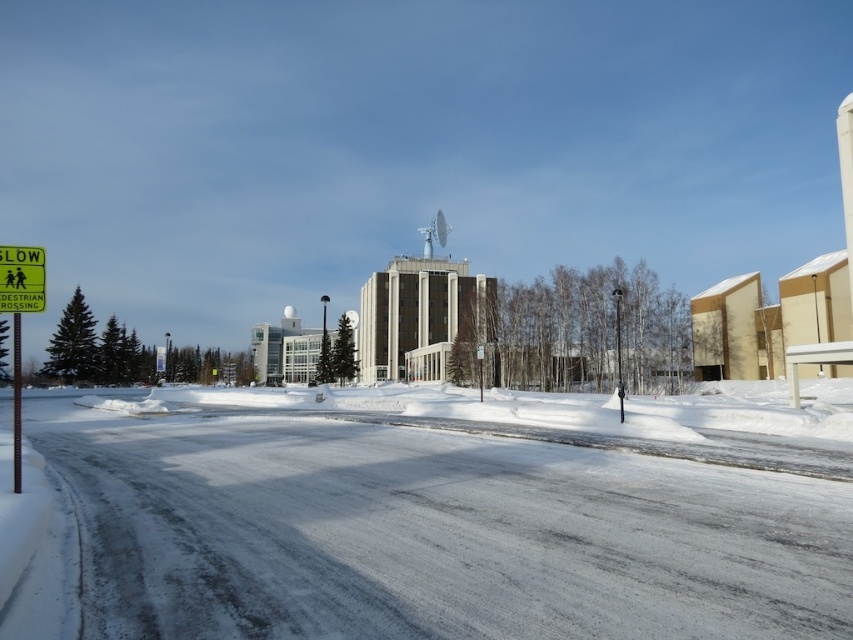
Between white powdery snow at center and metallic pole at left, which one appears on the left side from the viewer's perspective?

Positioned to the left is metallic pole at left.

Does white powdery snow at center appear over metallic pole at left?

Incorrect, white powdery snow at center is not positioned above metallic pole at left.

Is point (352, 605) in front of point (16, 448)?

That is True.

Where is `white powdery snow at center`? Image resolution: width=853 pixels, height=640 pixels. white powdery snow at center is located at coordinates (433, 536).

Which is behind, point (6, 282) or point (18, 376)?

Point (18, 376)

This screenshot has width=853, height=640. Identify the location of yellow plastic sign at left. (21, 278).

Between point (9, 291) and point (18, 369), which one is positioned in front?

Point (9, 291)

Find the location of a particular element. The height and width of the screenshot is (640, 853). yellow plastic sign at left is located at coordinates (21, 278).

Between white powdery snow at center and yellow plastic sign at left, which one has more height?

With more height is white powdery snow at center.

How far apart are white powdery snow at center and yellow plastic sign at left?

A distance of 25.31 feet exists between white powdery snow at center and yellow plastic sign at left.

Is point (323, 477) closer to viewer compared to point (10, 310)?

No, (323, 477) is further to viewer.

This screenshot has height=640, width=853. Find the location of `white powdery snow at center`. white powdery snow at center is located at coordinates (433, 536).